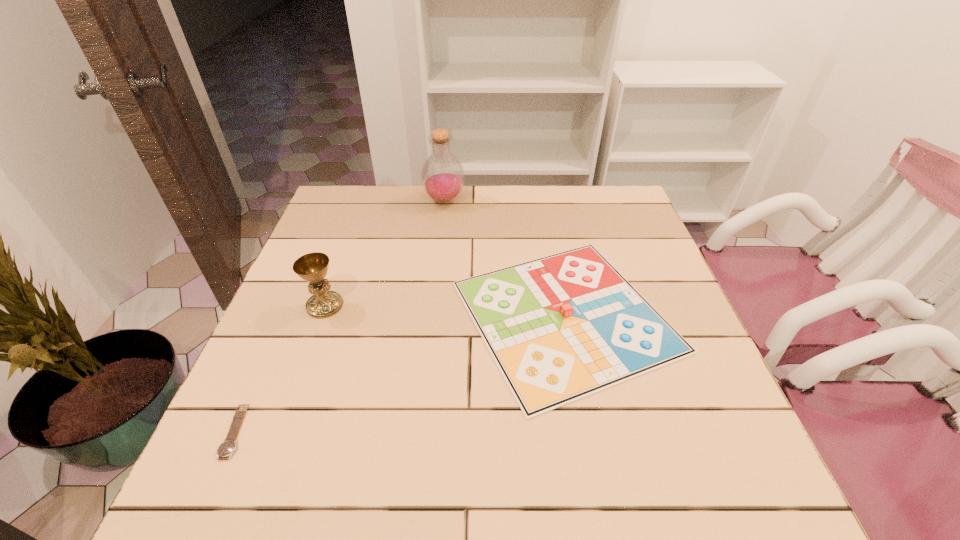
Where is `the farthest object`? the farthest object is located at coordinates (442, 175).

I want to click on bottle, so click(x=442, y=175).

Locate an element on the screen. The height and width of the screenshot is (540, 960). the third shortest object is located at coordinates (312, 267).

This screenshot has width=960, height=540. Identify the location of chalice. (312, 267).

Locate an element on the screen. This screenshot has width=960, height=540. gameboard is located at coordinates (562, 327).

Find the location of a particular element. This screenshot has height=540, width=960. the shortest object is located at coordinates point(229,445).

At what (x,y) coordinates should I click in order to perform the action: click on the leftmost object. Please return your answer as a coordinate pair (x, y). Looking at the image, I should click on (229, 445).

You are a GUI agent. You are given a task and a screenshot of the screen. Output one action in this format:
    pyautogui.click(x=<x>, y=<y>)
    Task: Click on the vacant space located 0.310m on the front of the bottle
    The width and height of the screenshot is (960, 540).
    Given the screenshot: What is the action you would take?
    pyautogui.click(x=436, y=280)

Identify the location of vacant space located 0.250m on the back of the third object from right to left. Image resolution: width=960 pixels, height=540 pixels. pyautogui.click(x=351, y=234).

Identify the location of vacant space located on the front of the gameboard. (601, 502).